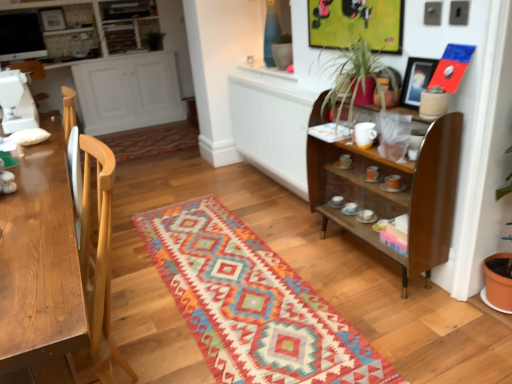
I want to click on vacant space underneath glossy wood shelf at upper right (from a real-world perspective), so click(x=370, y=256).